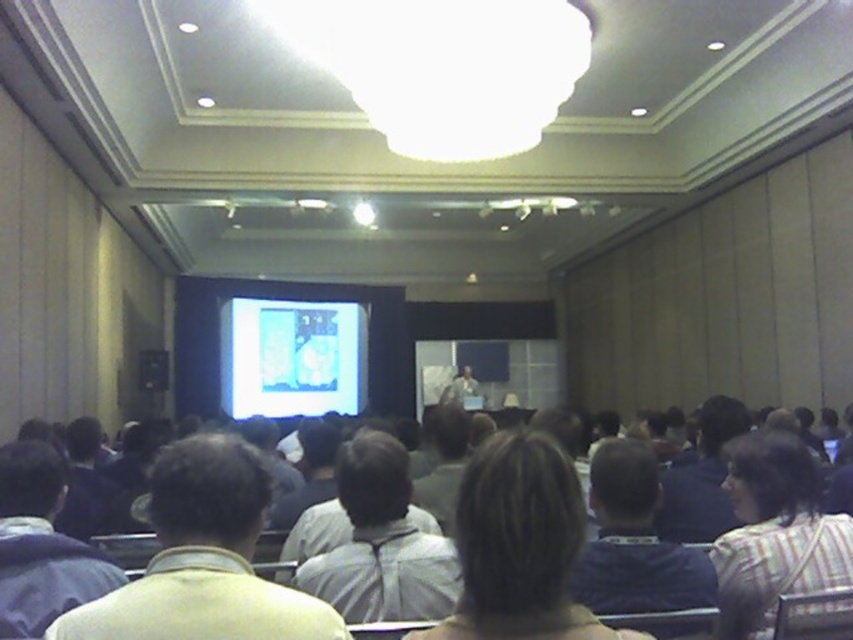
You are an attendee sitting in the audience and want to locate two specific points marked in the image. The first point is at coordinates point (335, 321) and the second is at point (701, 605). Which of these two points is closer to you?

Point (335, 321) is closer to you because it is further to the viewer than point (701, 605).

You are an attendee sitting in the audience and want to locate the speaker wearing the gray fabric shirt at center. Based on the coordinates provided, in which direction relative to the center of the stage should you look?

The gray fabric shirt at center is located at coordinates point (381, 544), which places it slightly to the right and above the center of the stage. Therefore, you should look towards the upper right direction relative to the center of the stage.

In the scene shown: You are sitting in the audience and want to see the speaker better. Which of the two shirts, the yellow fabric shirt at center or the light gray shirt at center, is positioned closer to you?

The yellow fabric shirt at center is closer to the viewer than the light gray shirt at center, so the yellow one is positioned closer to you.